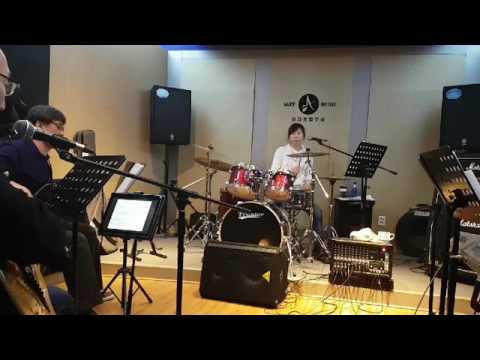
Locate an element on the screen. Image resolution: width=480 pixels, height=360 pixels. amplifier is located at coordinates (253, 277).